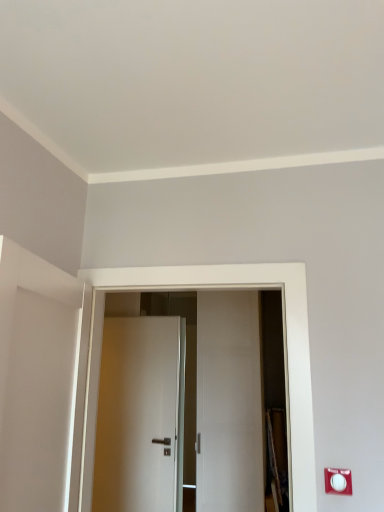
You are a GUI agent. You are given a task and a screenshot of the screen. Output one action in this format:
    pyautogui.click(x=<x>, y=<y>)
    Task: Click on the white glossy door at center, which is counted as the 2th door, starting from the back
    
    Given the screenshot: What is the action you would take?
    pyautogui.click(x=284, y=353)

At what (x,y) coordinates should I click in order to perform the action: click on white matte door at center, the second door viewed from the front. Please return your answer as a coordinate pair (x, y). This screenshot has width=384, height=512. Looking at the image, I should click on (140, 415).

Considering the relative sizes of white glossy door at center, which appears as the 1th door when viewed from the front, and white matte door at center, the second door viewed from the front, in the image provided, is white glossy door at center, which appears as the 1th door when viewed from the front, bigger than white matte door at center, the second door viewed from the front,?

Yes, white glossy door at center, which appears as the 1th door when viewed from the front, is bigger than white matte door at center, the second door viewed from the front.

Who is shorter, white glossy door at center, which is counted as the 2th door, starting from the back, or white matte door at center, the second door viewed from the front?

white glossy door at center, which is counted as the 2th door, starting from the back, is shorter.

This screenshot has height=512, width=384. What are the coordinates of `door to the left of white glossy door at center, which is counted as the 2th door, starting from the back` in the screenshot? It's located at (140, 415).

Which object is positioned more to the left, white glossy door at center, which is counted as the 2th door, starting from the back, or white matte door at center, the second door viewed from the front?

white matte door at center, the second door viewed from the front.

Can you confirm if white matte door at center, which is the first door in back-to-front order, is wider than white plastic electric outlet at lower right?

Yes, white matte door at center, which is the first door in back-to-front order, is wider than white plastic electric outlet at lower right.

From the image's perspective, which object appears higher, white matte door at center, which is the first door in back-to-front order, or white plastic electric outlet at lower right?

white plastic electric outlet at lower right is shown above in the image.

Are white matte door at center, which is the first door in back-to-front order, and white plastic electric outlet at lower right making contact?

They are not placed beside each other.

Considering their positions, is white matte door at center, the second door viewed from the front, located in front of or behind white plastic electric outlet at lower right?

Visually, white matte door at center, the second door viewed from the front, is located behind white plastic electric outlet at lower right.

Who is shorter, white plastic electric outlet at lower right or white matte door at center, the second door viewed from the front?

white plastic electric outlet at lower right.

From the image's perspective, which is below, white plastic electric outlet at lower right or white matte door at center, which is the first door in back-to-front order?

white matte door at center, which is the first door in back-to-front order.

The width and height of the screenshot is (384, 512). There is a white matte door at center, the second door viewed from the front. In order to click on electric outlet above it (from a real-world perspective) in this screenshot , I will do `click(338, 481)`.

Considering the sizes of objects white plastic electric outlet at lower right and white matte door at center, the second door viewed from the front, in the image provided, who is smaller, white plastic electric outlet at lower right or white matte door at center, the second door viewed from the front,?

white plastic electric outlet at lower right is smaller.

Which of these two, white glossy door at center, which appears as the 1th door when viewed from the front, or white plastic electric outlet at lower right, is thinner?

Thinner between the two is white plastic electric outlet at lower right.

From the picture: Is white glossy door at center, which appears as the 1th door when viewed from the front, taller or shorter than white plastic electric outlet at lower right?

white glossy door at center, which appears as the 1th door when viewed from the front, is taller than white plastic electric outlet at lower right.

Is white glossy door at center, which appears as the 1th door when viewed from the front, to the left or to the right of white plastic electric outlet at lower right in the image?

white glossy door at center, which appears as the 1th door when viewed from the front, is to the left of white plastic electric outlet at lower right.

Who is more distant, white glossy door at center, which appears as the 1th door when viewed from the front, or white plastic electric outlet at lower right?

white plastic electric outlet at lower right is further away from the camera.

How many degrees apart are the facing directions of white matte door at center, which is the first door in back-to-front order, and white glossy door at center, which appears as the 1th door when viewed from the front?

The angular difference between white matte door at center, which is the first door in back-to-front order, and white glossy door at center, which appears as the 1th door when viewed from the front, is 2.68 degrees.

Where is `door that appears below the white glossy door at center, which appears as the 1th door when viewed from the front (from a real-world perspective)`? door that appears below the white glossy door at center, which appears as the 1th door when viewed from the front (from a real-world perspective) is located at coordinates (140, 415).

Consider the image. From the image's perspective, does white matte door at center, the second door viewed from the front, appear higher than white glossy door at center, which is counted as the 2th door, starting from the back?

No, from the image's perspective, white matte door at center, the second door viewed from the front, is not on top of white glossy door at center, which is counted as the 2th door, starting from the back.

Between white matte door at center, which is the first door in back-to-front order, and white glossy door at center, which is counted as the 2th door, starting from the back, which one has larger width?

With larger width is white glossy door at center, which is counted as the 2th door, starting from the back.

Which object is more forward, white plastic electric outlet at lower right or white glossy door at center, which appears as the 1th door when viewed from the front?

white glossy door at center, which appears as the 1th door when viewed from the front, is in front.

Is white plastic electric outlet at lower right next to white glossy door at center, which appears as the 1th door when viewed from the front, and touching it?

No, white plastic electric outlet at lower right is not making contact with white glossy door at center, which appears as the 1th door when viewed from the front.

In terms of width, does white plastic electric outlet at lower right look wider or thinner when compared to white glossy door at center, which appears as the 1th door when viewed from the front?

Considering their sizes, white plastic electric outlet at lower right looks slimmer than white glossy door at center, which appears as the 1th door when viewed from the front.

I want to click on door that appears above the white matte door at center, which is the first door in back-to-front order (from a real-world perspective), so click(x=284, y=353).

Where is `electric outlet above the white matte door at center, which is the first door in back-to-front order (from the image's perspective)`? The height and width of the screenshot is (512, 384). electric outlet above the white matte door at center, which is the first door in back-to-front order (from the image's perspective) is located at coordinates (338, 481).

Looking at the image, which one is located closer to white matte door at center, which is the first door in back-to-front order, white glossy door at center, which appears as the 1th door when viewed from the front, or white plastic electric outlet at lower right?

white glossy door at center, which appears as the 1th door when viewed from the front, is positioned closer to the anchor white matte door at center, which is the first door in back-to-front order.

Based on their spatial positions, is white plastic electric outlet at lower right or white glossy door at center, which is counted as the 2th door, starting from the back, further from white matte door at center, which is the first door in back-to-front order?

The object further to white matte door at center, which is the first door in back-to-front order, is white plastic electric outlet at lower right.

When comparing their distances from white plastic electric outlet at lower right, does white matte door at center, the second door viewed from the front, or white glossy door at center, which appears as the 1th door when viewed from the front, seem further?

white matte door at center, the second door viewed from the front, lies further to white plastic electric outlet at lower right than the other object.

Consider the image. When comparing their distances from white glossy door at center, which is counted as the 2th door, starting from the back, does white plastic electric outlet at lower right or white matte door at center, which is the first door in back-to-front order, seem further?

The object further to white glossy door at center, which is counted as the 2th door, starting from the back, is white matte door at center, which is the first door in back-to-front order.

When comparing their distances from white glossy door at center, which appears as the 1th door when viewed from the front, does white matte door at center, which is the first door in back-to-front order, or white plastic electric outlet at lower right seem further?

Among the two, white matte door at center, which is the first door in back-to-front order, is located further to white glossy door at center, which appears as the 1th door when viewed from the front.

When comparing their distances from white plastic electric outlet at lower right, does white glossy door at center, which appears as the 1th door when viewed from the front, or white matte door at center, which is the first door in back-to-front order, seem further?

Based on the image, white matte door at center, which is the first door in back-to-front order, appears to be further to white plastic electric outlet at lower right.

Where is `electric outlet between white glossy door at center, which is counted as the 2th door, starting from the back, and white matte door at center, which is the first door in back-to-front order, along the z-axis`? The width and height of the screenshot is (384, 512). electric outlet between white glossy door at center, which is counted as the 2th door, starting from the back, and white matte door at center, which is the first door in back-to-front order, along the z-axis is located at coordinates (338, 481).